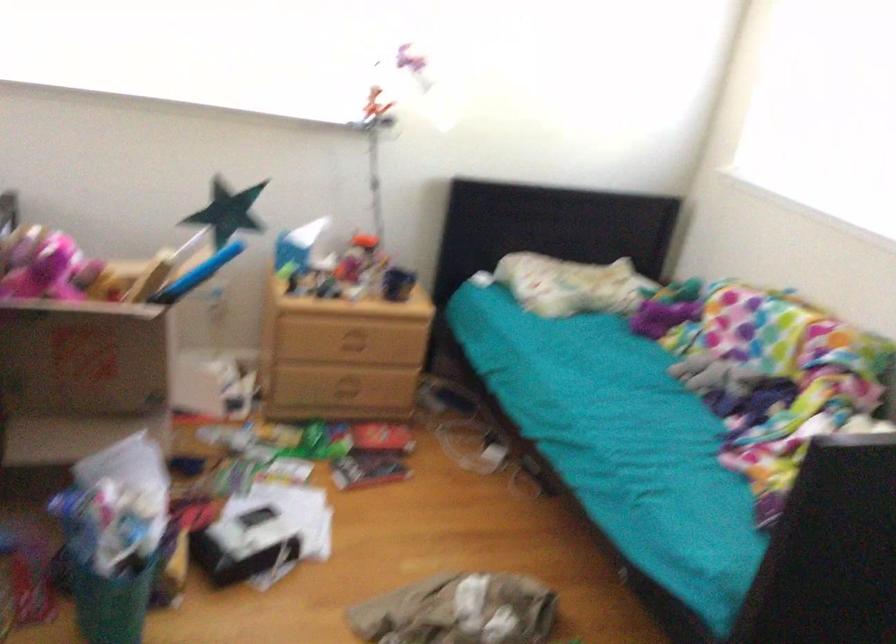
The image size is (896, 644). I want to click on green wastebasket, so click(x=108, y=592).